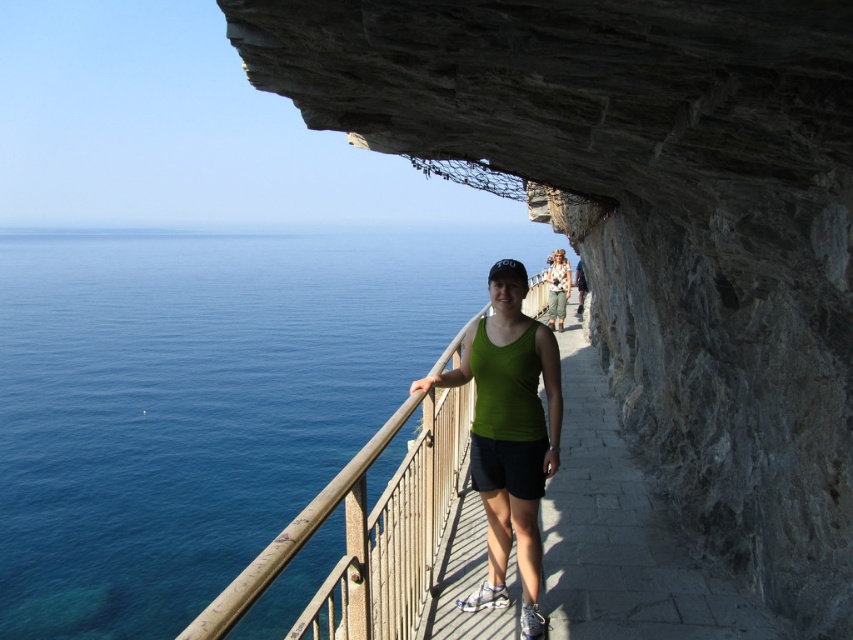
Question: Is blue liquid water at left thinner than green fabric tank top at center?

Choices:
 (A) yes
 (B) no

Answer: (B)

Question: From the image, what is the correct spatial relationship of gray stone cliff at upper center in relation to green fabric tank top at center?

Choices:
 (A) right
 (B) left

Answer: (A)

Question: Is green fabric tank top at center to the left of floral fabric shirt at center from the viewer's perspective?

Choices:
 (A) no
 (B) yes

Answer: (B)

Question: Considering the real-world distances, which object is closest to the gray stone cliff at upper center?

Choices:
 (A) green fabric tank top at center
 (B) blue liquid water at left
 (C) floral fabric shirt at center

Answer: (A)

Question: Among these objects, which one is farthest from the camera?

Choices:
 (A) floral fabric shirt at center
 (B) gray stone cliff at upper center
 (C) green fabric tank top at center

Answer: (A)

Question: Which of the following is the closest to the observer?

Choices:
 (A) (495, 532)
 (B) (573, 234)

Answer: (A)